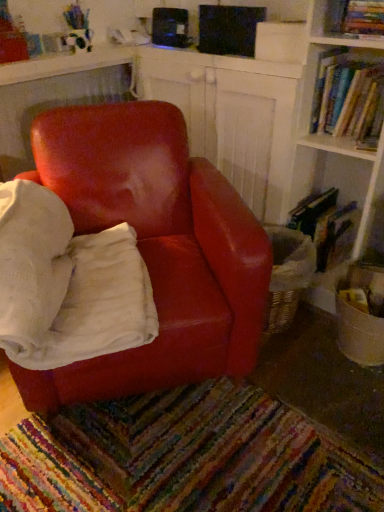
Question: Considering the positions of hardcover book at right, marked as the 1th book in a bottom-to-top arrangement, and hardcover book at upper right, the 1th book in the top-to-bottom sequence, in the image, is hardcover book at right, marked as the 1th book in a bottom-to-top arrangement, wider or thinner than hardcover book at upper right, the 1th book in the top-to-bottom sequence,?

Choices:
 (A) wide
 (B) thin

Answer: (A)

Question: Is hardcover book at right, marked as the 1th book in a bottom-to-top arrangement, taller or shorter than hardcover book at upper right, the third book in the bottom-to-top sequence?

Choices:
 (A) tall
 (B) short

Answer: (A)

Question: Which object is the closest to the hardcover books at upper right, the 2th book in the top-to-bottom sequence?

Choices:
 (A) hardcover book at upper right, the third book in the bottom-to-top sequence
 (B) hardcover book at right, marked as the 1th book in a bottom-to-top arrangement
 (C) matte leather chair at center

Answer: (A)

Question: Estimate the real-world distances between objects in this image. Which object is farther from the hardcover books at upper right, the 2th book in the top-to-bottom sequence?

Choices:
 (A) hardcover book at upper right, the 1th book in the top-to-bottom sequence
 (B) matte leather chair at center
 (C) hardcover book at right, marked as the 1th book in a bottom-to-top arrangement

Answer: (B)